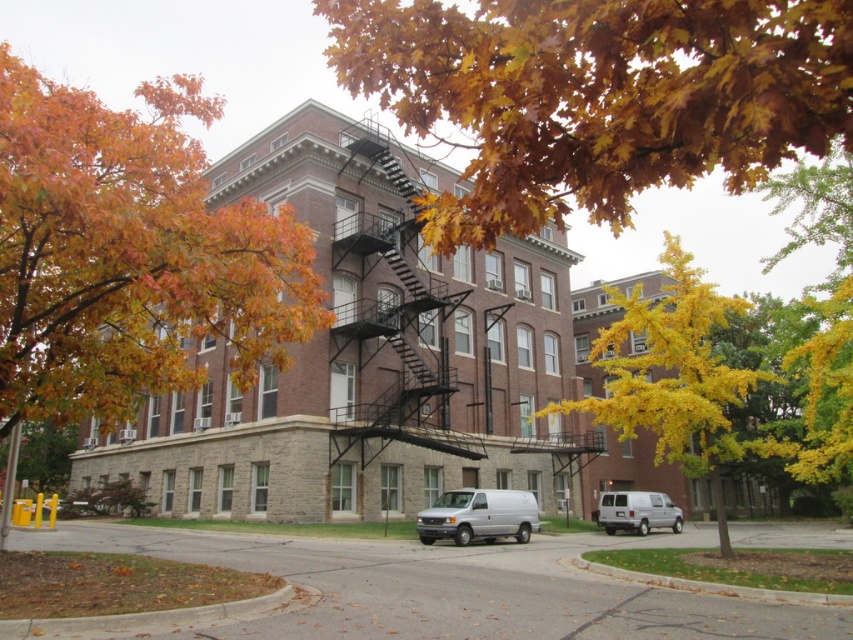
Question: Which object is positioned closest to the white matte van at center?

Choices:
 (A) orange leafy tree at upper left
 (B) yellow/golden leaves at center
 (C) white matte van at lower right
 (D) golden leafy branch at upper center

Answer: (C)

Question: Is orange leafy tree at upper left above black metal fire escape at center?

Choices:
 (A) no
 (B) yes

Answer: (B)

Question: Is golden leafy branch at upper center above black metal fire escape at center?

Choices:
 (A) no
 (B) yes

Answer: (B)

Question: Where is yellow/golden leaves at center located in relation to white matte van at lower right in the image?

Choices:
 (A) left
 (B) right

Answer: (B)

Question: Among these points, which one is nearest to the camera?

Choices:
 (A) (355, 419)
 (B) (605, 496)
 (C) (706, 97)

Answer: (C)

Question: Which of the following is the closest to the observer?

Choices:
 (A) white matte van at lower right
 (B) golden leafy branch at upper center

Answer: (B)